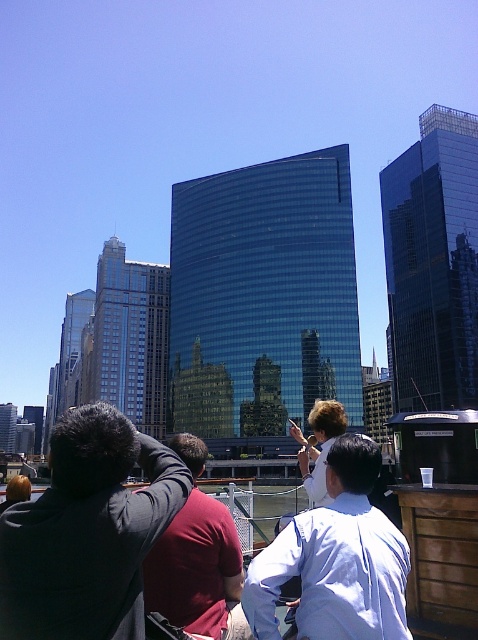
In the scene shown: You are standing at the point with coordinates point (26, 476) and want to take a photo of the point with coordinates point (402, 612). Is there any obstruction between you and the point you want to photograph?

Point (402, 612) is in front of point (26, 476), so there is an obstruction between you and the point you want to photograph.

You are standing at the center of the image and want to locate the black fabric jacket at center. According to the coordinates provided, in which direction should you look to find it?

The black fabric jacket at center is located at coordinates point (87, 532). Since the coordinate system is not specified, but assuming standard image coordinates where x increases to the right and y increases downward, the jacket would be positioned to the right and slightly below the center point.